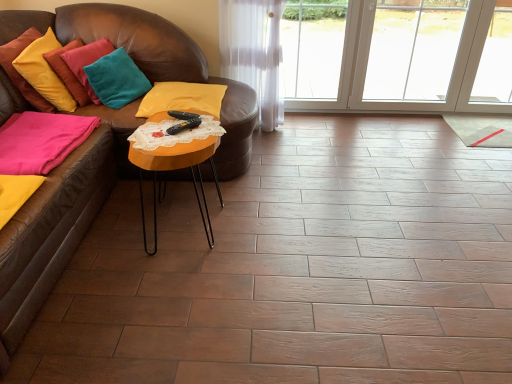
Question: In which direction should I rotate to look at yellow velvet pillow at center, which is the 4th pillow in left-to-right order?

Choices:
 (A) left
 (B) right

Answer: (A)

Question: Is orange wood table at center smaller than velvet yellow pillow at upper left, the fourth pillow viewed from the right?

Choices:
 (A) yes
 (B) no

Answer: (B)

Question: Considering the relative sizes of orange wood table at center and velvet yellow pillow at upper left, which is the 1th pillow from left to right, in the image provided, is orange wood table at center bigger than velvet yellow pillow at upper left, which is the 1th pillow from left to right,?

Choices:
 (A) no
 (B) yes

Answer: (B)

Question: Is orange wood table at center behind velvet yellow pillow at upper left, the fourth pillow viewed from the right?

Choices:
 (A) no
 (B) yes

Answer: (A)

Question: Could you tell me if orange wood table at center is turned towards velvet yellow pillow at upper left, which is the 1th pillow from left to right?

Choices:
 (A) yes
 (B) no

Answer: (B)

Question: Is orange wood table at center thinner than velvet yellow pillow at upper left, which is the 1th pillow from left to right?

Choices:
 (A) yes
 (B) no

Answer: (B)

Question: Does orange wood table at center have a greater width compared to velvet yellow pillow at upper left, which is the 1th pillow from left to right?

Choices:
 (A) yes
 (B) no

Answer: (A)

Question: Is orange wood table at center closer to the viewer compared to teal velvet pillow at upper left, which is the 3th pillow from left to right?

Choices:
 (A) no
 (B) yes

Answer: (B)

Question: From the image's perspective, is orange wood table at center over teal velvet pillow at upper left, which is the 3th pillow from left to right?

Choices:
 (A) yes
 (B) no

Answer: (B)

Question: Does orange wood table at center have a lesser width compared to teal velvet pillow at upper left, which is the 3th pillow from left to right?

Choices:
 (A) yes
 (B) no

Answer: (B)

Question: Can you confirm if orange wood table at center is positioned to the left of teal velvet pillow at upper left, which ranks as the second pillow in right-to-left order?

Choices:
 (A) yes
 (B) no

Answer: (B)

Question: From a real-world perspective, is orange wood table at center located higher than teal velvet pillow at upper left, which ranks as the second pillow in right-to-left order?

Choices:
 (A) yes
 (B) no

Answer: (B)

Question: Can you confirm if orange wood table at center is bigger than teal velvet pillow at upper left, which ranks as the second pillow in right-to-left order?

Choices:
 (A) no
 (B) yes

Answer: (B)

Question: From the image's perspective, would you say velvet yellow pillow at upper left, which is the 1th pillow from left to right, is positioned over yellow velvet pillow at center, positioned as the first pillow in right-to-left order?

Choices:
 (A) yes
 (B) no

Answer: (A)